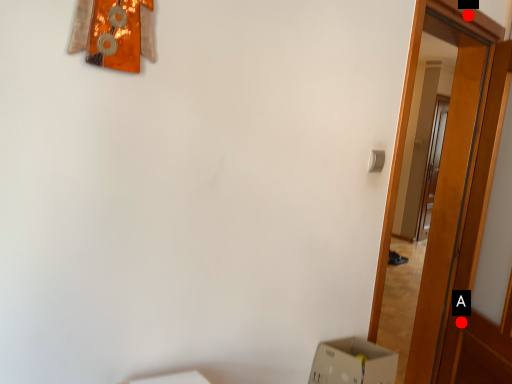
Question: Two points are circled on the image, labeled by A and B beside each circle. Which of the following is the farthest from the observer?

Choices:
 (A) A is further
 (B) B is further

Answer: (A)